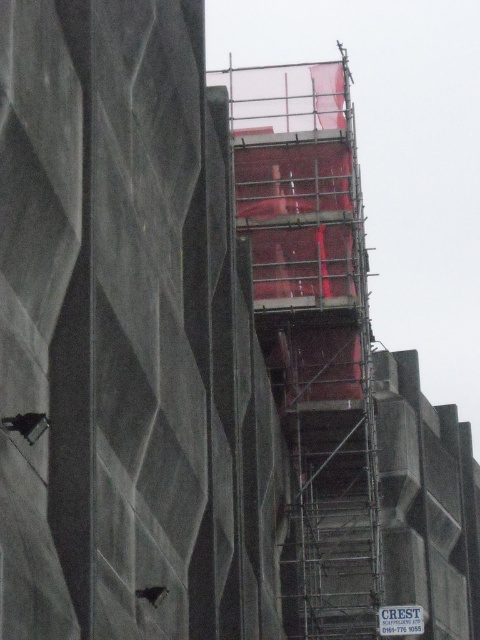
Is point (288, 385) positioned in front of point (414, 628)?

No, (288, 385) is behind (414, 628).

Consider the image. Does metallic scaffolding at center have a smaller size compared to blue plastic sign at upper center?

Incorrect, metallic scaffolding at center is not smaller in size than blue plastic sign at upper center.

What do you see at coordinates (312, 330) in the screenshot? I see `metallic scaffolding at center` at bounding box center [312, 330].

Image resolution: width=480 pixels, height=640 pixels. Find the location of `metallic scaffolding at center`. metallic scaffolding at center is located at coordinates (312, 330).